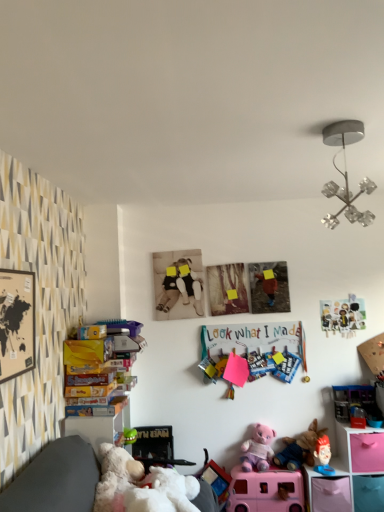
Question: In the image, is purple plush bear at center, placed as the 2th toy when sorted from bottom to top, on the left side or the right side of multicolored paper clips at center?

Choices:
 (A) left
 (B) right

Answer: (B)

Question: Based on their sizes in the image, would you say purple plush bear at center, the 5th toy positioned from the top, is bigger or smaller than multicolored paper clips at center?

Choices:
 (A) small
 (B) big

Answer: (B)

Question: Based on their relative distances, which object is nearer to the matte plastic picture frame at upper right, the 6th toy ordered from the bottom?

Choices:
 (A) fluffy plush toy at lower center, marked as the third toy in a top-to-bottom arrangement
 (B) white plush teddy bear at lower left
 (C) pink plastic shelf at lower right, which ranks as the second shelf in bottom-to-top order
 (D) multicolored paper clips at center
 (E) metallic silver chandelier at upper right

Answer: (D)

Question: Which is nearer to the fluffy plush toy at lower center, marked as the third toy in a top-to-bottom arrangement?

Choices:
 (A) purple plush bear at center, placed as the 2th toy when sorted from bottom to top
 (B) pink plastic shelf at lower right, which ranks as the second shelf in bottom-to-top order
 (C) white plush teddy bear at lower left
 (D) matte plastic picture frame at upper right, acting as the first toy starting from the top
 (E) pink plastic shelf at lower right, the second shelf in the top-to-bottom sequence

Answer: (A)